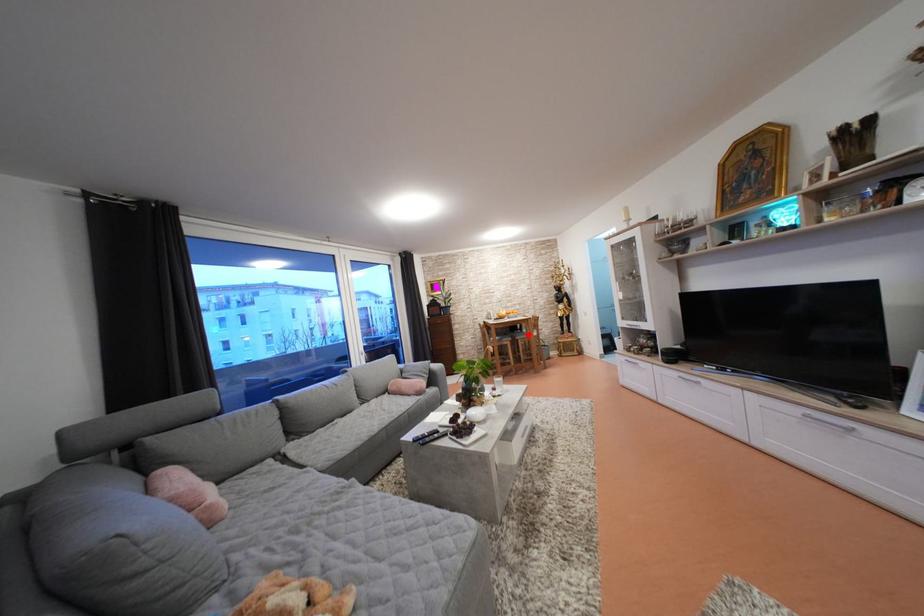
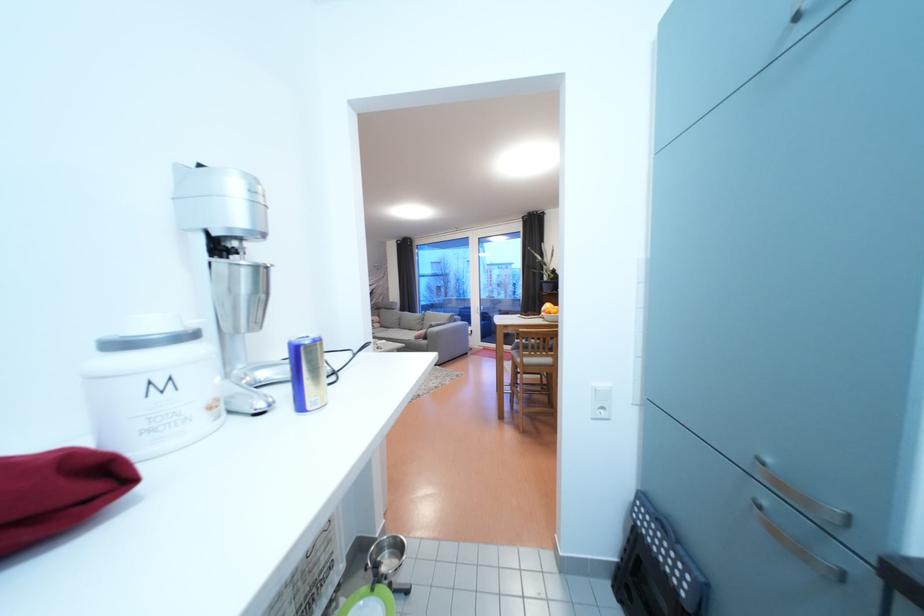
Question: I am providing you with two images of the same scene from different viewpoints. A red point is marked on the first image. At the location where the point appears in image 1, is it still visible in image 2?

Choices:
 (A) Yes
 (B) No

Answer: (B)